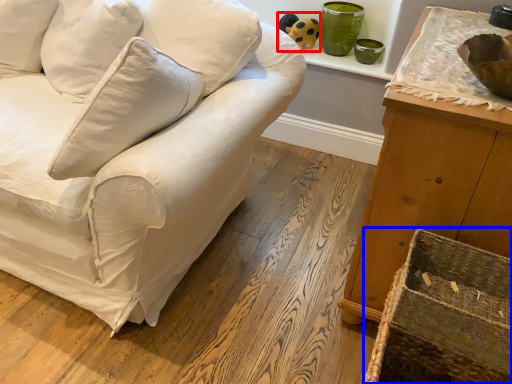
Question: Which of the following is the closest to the observer, toy (highlighted by a red box) or crate (highlighted by a blue box)?

Choices:
 (A) toy
 (B) crate

Answer: (B)